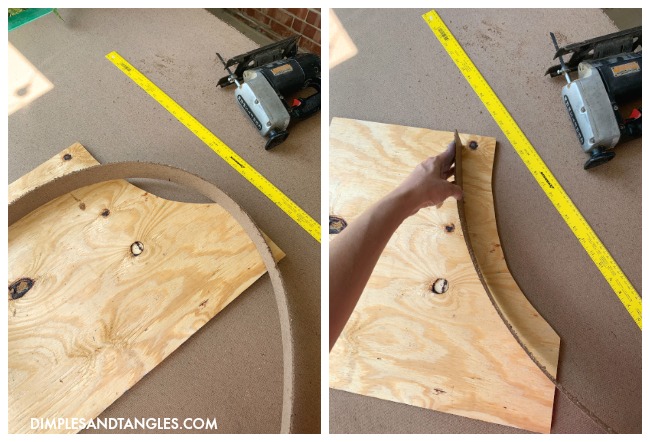
This screenshot has height=442, width=650. What are the coordinates of `empty space on table` in the screenshot? It's located at pyautogui.click(x=413, y=65), pyautogui.click(x=91, y=93).